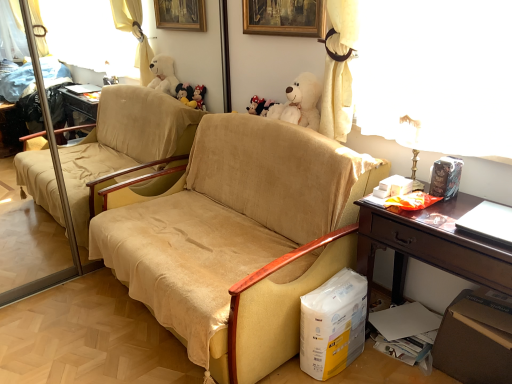
Question: Can you confirm if white plush bear at upper center is taller than brown wooden desk at right?

Choices:
 (A) no
 (B) yes

Answer: (A)

Question: Is white plush bear at upper center beside brown wooden desk at right?

Choices:
 (A) no
 (B) yes

Answer: (A)

Question: Is white plush bear at upper center thinner than brown wooden desk at right?

Choices:
 (A) no
 (B) yes

Answer: (B)

Question: Would you say white plush bear at upper center is outside brown wooden desk at right?

Choices:
 (A) yes
 (B) no

Answer: (A)

Question: Can you confirm if white plush bear at upper center is positioned to the left of brown wooden desk at right?

Choices:
 (A) yes
 (B) no

Answer: (A)

Question: From the image's perspective, is white plush bear at upper center under brown wooden desk at right?

Choices:
 (A) yes
 (B) no

Answer: (B)

Question: From a real-world perspective, does brown cardboard box at lower right sit lower than white plush bear at upper center?

Choices:
 (A) yes
 (B) no

Answer: (A)

Question: Can you confirm if brown cardboard box at lower right is smaller than white plush bear at upper center?

Choices:
 (A) yes
 (B) no

Answer: (B)

Question: Is brown cardboard box at lower right oriented away from white plush bear at upper center?

Choices:
 (A) no
 (B) yes

Answer: (A)

Question: Is brown cardboard box at lower right not close to white plush bear at upper center?

Choices:
 (A) yes
 (B) no

Answer: (A)

Question: Does brown cardboard box at lower right have a larger size compared to white plush bear at upper center?

Choices:
 (A) no
 (B) yes

Answer: (B)

Question: Would you say brown cardboard box at lower right is outside white plush bear at upper center?

Choices:
 (A) no
 (B) yes

Answer: (B)

Question: From a real-world perspective, is beige fabric chair at center located beneath white plush bear at upper center?

Choices:
 (A) yes
 (B) no

Answer: (A)